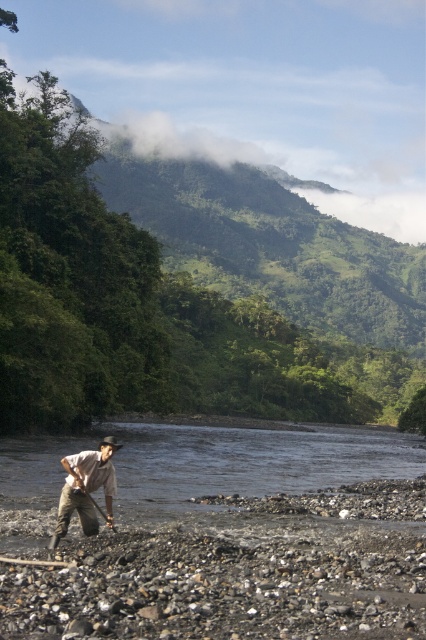
Question: Can you confirm if light brown cotton shirt at lower left is positioned below shiny metallic shovel at lower center?

Choices:
 (A) no
 (B) yes

Answer: (A)

Question: Which point is closer to the camera?

Choices:
 (A) (109, 452)
 (B) (83, 492)

Answer: (B)

Question: Which of the following is the farthest from the observer?

Choices:
 (A) (97, 509)
 (B) (89, 492)

Answer: (A)

Question: Can you confirm if light brown cotton shirt at lower left is positioned below shiny metallic shovel at lower center?

Choices:
 (A) no
 (B) yes

Answer: (A)

Question: In this image, where is light brown cotton shirt at lower left located relative to shiny metallic shovel at lower center?

Choices:
 (A) left
 (B) right

Answer: (A)